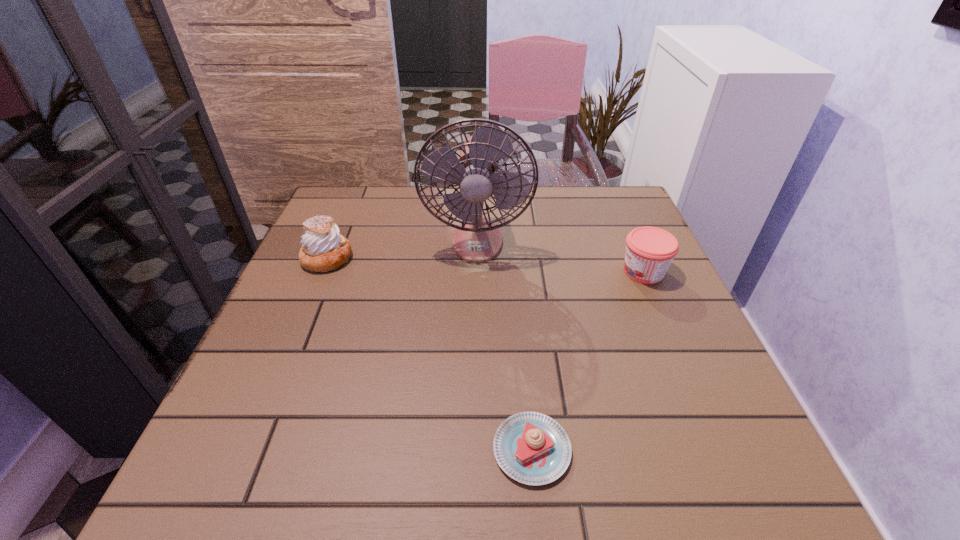
At what (x,y) coordinates should I click in order to perform the action: click on free space that satisfies the following two spatial constraints: 1. on the front side of the right pastry; 2. on the left side of the leftmost object. Please return your answer as a coordinate pair (x, y). Looking at the image, I should click on (248, 449).